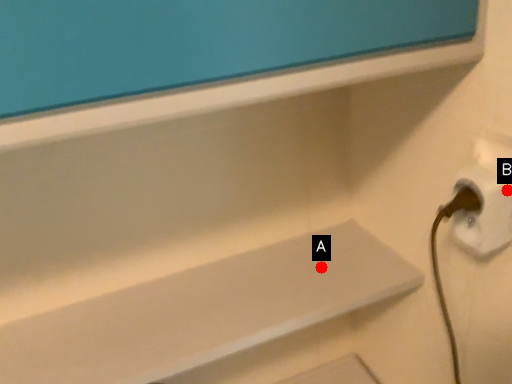
Question: Two points are circled on the image, labeled by A and B beside each circle. Which point is closer to the camera?

Choices:
 (A) A is closer
 (B) B is closer

Answer: (B)